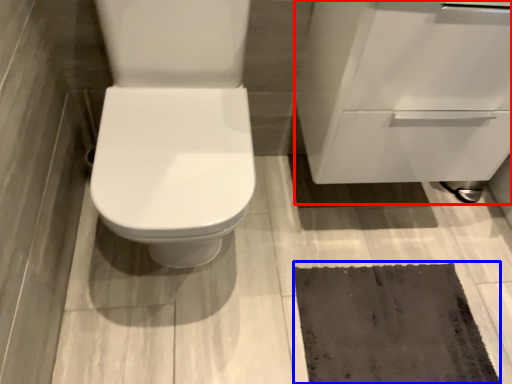
Question: Which object appears closest to the camera in this image, cabinetry (highlighted by a red box) or doormat (highlighted by a blue box)?

Choices:
 (A) cabinetry
 (B) doormat

Answer: (A)